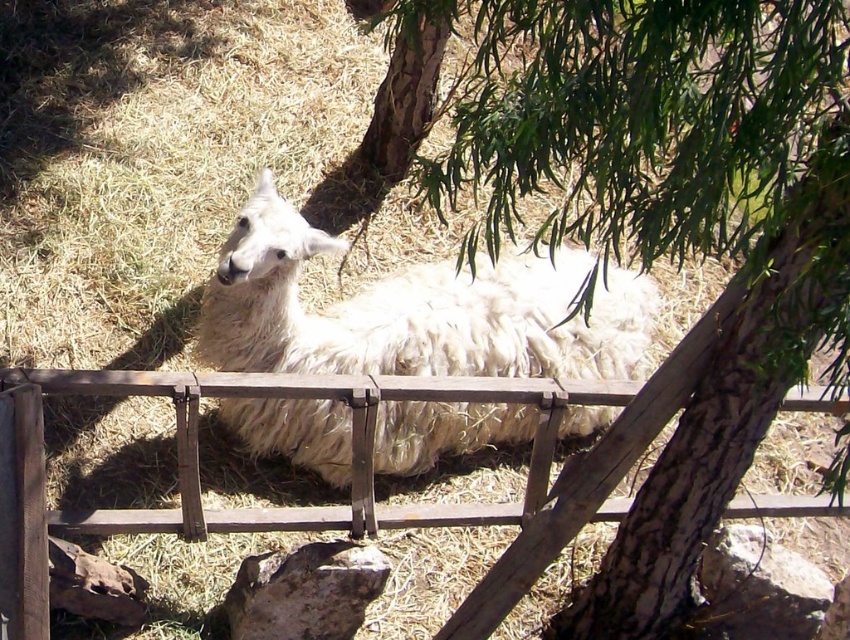
Question: Which of the following is the closest to the observer?

Choices:
 (A) wooden gate at center
 (B) white fluffy alpaca at center
 (C) green leafy tree at center

Answer: (C)

Question: Does green leafy tree at center appear under wooden gate at center?

Choices:
 (A) yes
 (B) no

Answer: (B)

Question: Considering the relative positions of green leafy tree at center and wooden gate at center in the image provided, where is green leafy tree at center located with respect to wooden gate at center?

Choices:
 (A) right
 (B) left

Answer: (A)

Question: Which object is positioned farthest from the green leafy tree at center?

Choices:
 (A) white fluffy alpaca at center
 (B) wooden gate at center

Answer: (A)

Question: Considering the real-world distances, which object is farthest from the white fluffy alpaca at center?

Choices:
 (A) green leafy tree at center
 (B) wooden gate at center

Answer: (A)

Question: Considering the relative positions of green leafy tree at center and white fluffy alpaca at center in the image provided, where is green leafy tree at center located with respect to white fluffy alpaca at center?

Choices:
 (A) above
 (B) below

Answer: (A)